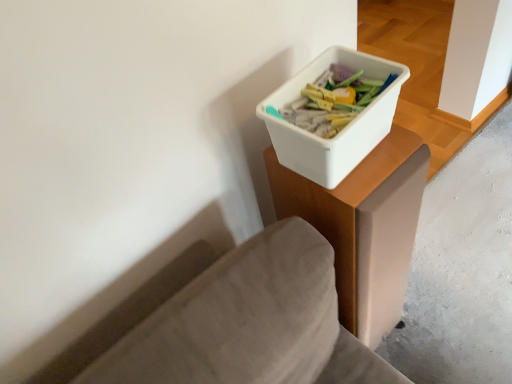
Locate an element on the screen. vacant space underneath smooth concrete at lower right (from a real-world perspective) is located at coordinates (467, 250).